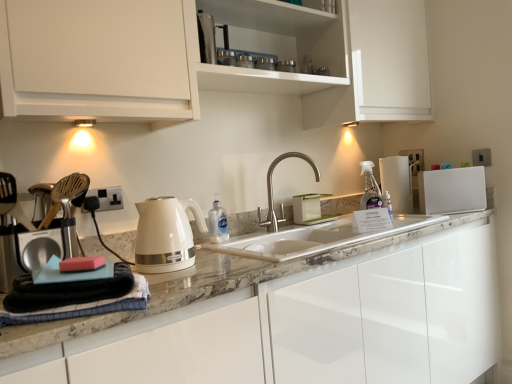
Question: Would you consider glossy white cabinet at center, the 1th cabinetry in the bottom-to-top sequence, to be distant from white glossy electric kettle at center-left?

Choices:
 (A) yes
 (B) no

Answer: (B)

Question: Considering the relative sizes of glossy white cabinet at center, the 1th cabinetry in the bottom-to-top sequence, and white glossy electric kettle at center-left in the image provided, is glossy white cabinet at center, the 1th cabinetry in the bottom-to-top sequence, taller than white glossy electric kettle at center-left?

Choices:
 (A) no
 (B) yes

Answer: (B)

Question: Could you tell me if glossy white cabinet at center, the 2th cabinetry in the top-to-bottom sequence, is turned towards white glossy electric kettle at center-left?

Choices:
 (A) yes
 (B) no

Answer: (B)

Question: Is glossy white cabinet at center, the 1th cabinetry in the bottom-to-top sequence, outside white glossy electric kettle at center-left?

Choices:
 (A) yes
 (B) no

Answer: (A)

Question: From a real-world perspective, does glossy white cabinet at center, the 1th cabinetry in the bottom-to-top sequence, sit lower than white glossy electric kettle at center-left?

Choices:
 (A) no
 (B) yes

Answer: (B)

Question: Does glossy white cabinet at center, the 1th cabinetry in the bottom-to-top sequence, contain white glossy electric kettle at center-left?

Choices:
 (A) no
 (B) yes

Answer: (A)

Question: From the image's perspective, does black plastic electrical outlet at left, the 1th electric outlet positioned from the front, appear higher than glossy white cabinet at center, the 1th cabinetry in the bottom-to-top sequence?

Choices:
 (A) yes
 (B) no

Answer: (A)

Question: Can you confirm if black plastic electrical outlet at left, which ranks as the second electric outlet in right-to-left order, is wider than glossy white cabinet at center, the 1th cabinetry in the bottom-to-top sequence?

Choices:
 (A) yes
 (B) no

Answer: (B)

Question: Is black plastic electrical outlet at left, which is the 1th electric outlet from bottom to top, oriented away from glossy white cabinet at center, the 1th cabinetry in the bottom-to-top sequence?

Choices:
 (A) yes
 (B) no

Answer: (B)

Question: Is the depth of black plastic electrical outlet at left, marked as the 1th electric outlet in a left-to-right arrangement, less than that of glossy white cabinet at center, the 1th cabinetry in the bottom-to-top sequence?

Choices:
 (A) no
 (B) yes

Answer: (A)

Question: Are black plastic electrical outlet at left, marked as the 1th electric outlet in a left-to-right arrangement, and glossy white cabinet at center, the 2th cabinetry in the top-to-bottom sequence, beside each other?

Choices:
 (A) yes
 (B) no

Answer: (B)

Question: From the image's perspective, is black plastic electrical outlet at left, placed as the 2th electric outlet when sorted from back to front, under glossy white cabinet at center, the 2th cabinetry in the top-to-bottom sequence?

Choices:
 (A) no
 (B) yes

Answer: (A)

Question: Is satin nickel faucet at center at the left side of white plastic electric outlet at upper right, positioned as the first electric outlet in right-to-left order?

Choices:
 (A) yes
 (B) no

Answer: (A)